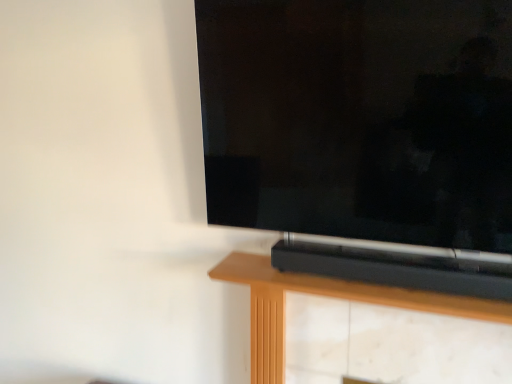
Question: Based on their positions, is matte black tv at center located to the left or right of black plastic soundbar at center?

Choices:
 (A) right
 (B) left

Answer: (B)

Question: From the image's perspective, is matte black tv at center positioned above or below black plastic soundbar at center?

Choices:
 (A) below
 (B) above

Answer: (B)

Question: Is matte black tv at center situated inside black plastic soundbar at center or outside?

Choices:
 (A) outside
 (B) inside

Answer: (A)

Question: Does point (263, 359) appear closer or farther from the camera than point (395, 173)?

Choices:
 (A) farther
 (B) closer

Answer: (A)

Question: Relative to matte black tv at center, is black plastic soundbar at center in front or behind?

Choices:
 (A) front
 (B) behind

Answer: (B)

Question: Is black plastic soundbar at center wider or thinner than matte black tv at center?

Choices:
 (A) wide
 (B) thin

Answer: (A)

Question: Is black plastic soundbar at center taller or shorter than matte black tv at center?

Choices:
 (A) tall
 (B) short

Answer: (B)